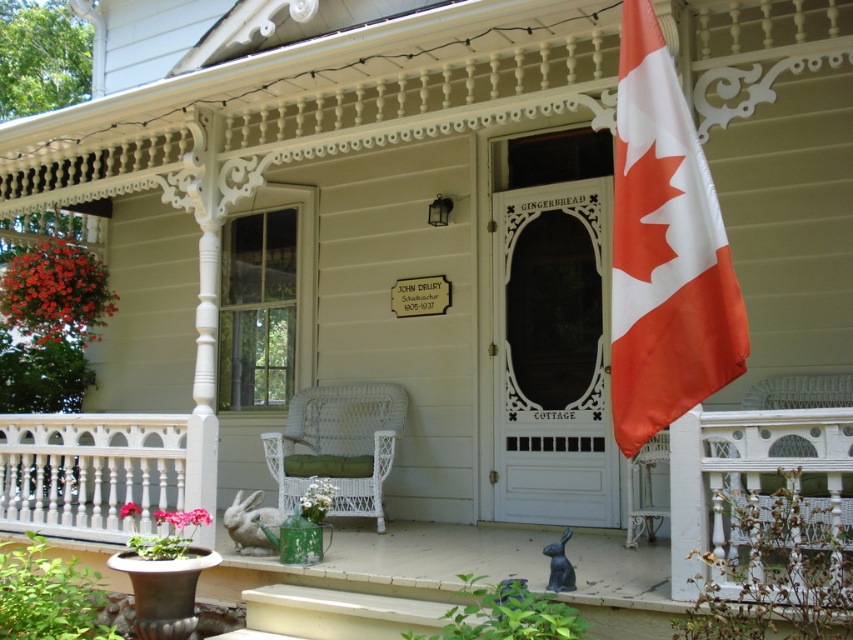
You are standing on the porch of the GINGERBREAD COTTAGE and looking at two points marked on the image. Which point, point (683, 580) or point (10, 504), is closer to you?

Point (683, 580) is closer to you than point (10, 504).